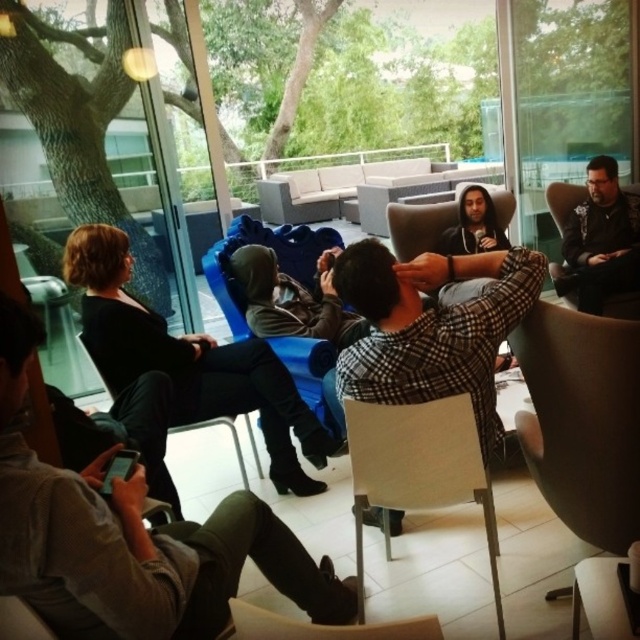
Question: Which point is closer to the camera?

Choices:
 (A) light beige fabric chair at center
 (B) matte black chair at center
 (C) transparent glass door at right

Answer: (A)

Question: Which of the following is the closest to the observer?

Choices:
 (A) pos(605,141)
 (B) pos(237,452)

Answer: (B)

Question: Does black checkered shirt at center have a lesser width compared to light beige fabric chair at center?

Choices:
 (A) yes
 (B) no

Answer: (B)

Question: Can you confirm if black fabric jacket at center is thinner than dark gray leather jacket at center?

Choices:
 (A) no
 (B) yes

Answer: (A)

Question: Is black checkered shirt at center wider than black fabric jacket at center?

Choices:
 (A) no
 (B) yes

Answer: (A)

Question: Considering the real-world distances, which object is farthest from the black checkered shirt at center?

Choices:
 (A) matte black chair at center
 (B) dark gray fabric jacket at center
 (C) transparent glass door at right
 (D) light beige fabric chair at center

Answer: (C)